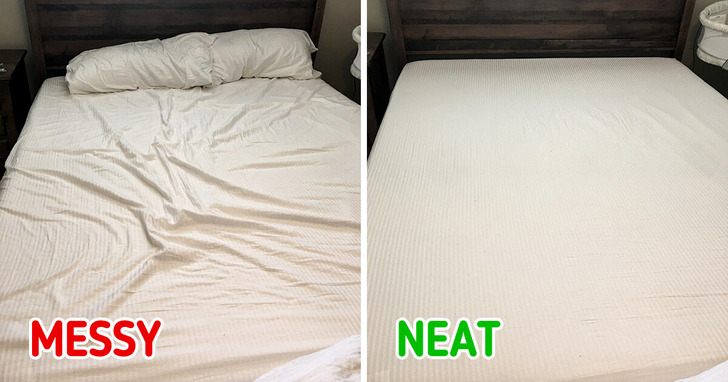
Where is `wall`? Image resolution: width=728 pixels, height=382 pixels. wall is located at coordinates 14,30, 376,14.